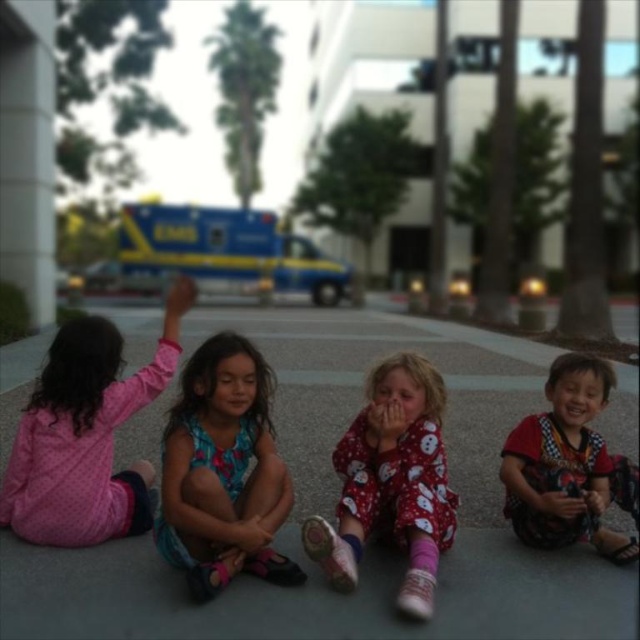
You are a delivery robot that is 1 meter wide. You need to deliver a package to the red pajama at center, but you have to pass by the pink polka dot pajamas at left. Is there enough space between them for you to move through?

The distance between the pink polka dot pajamas at left and the red pajama at center is 1.25 meters. Since the robot is 1 meter wide, there is sufficient space for it to pass through the 1.25 meter gap.

You are standing at point (426, 614) and want to walk to point (104, 371). Which direction should you move in to reach your destination?

Point (104, 371) is behind point (426, 614), so you should move backward to reach it.